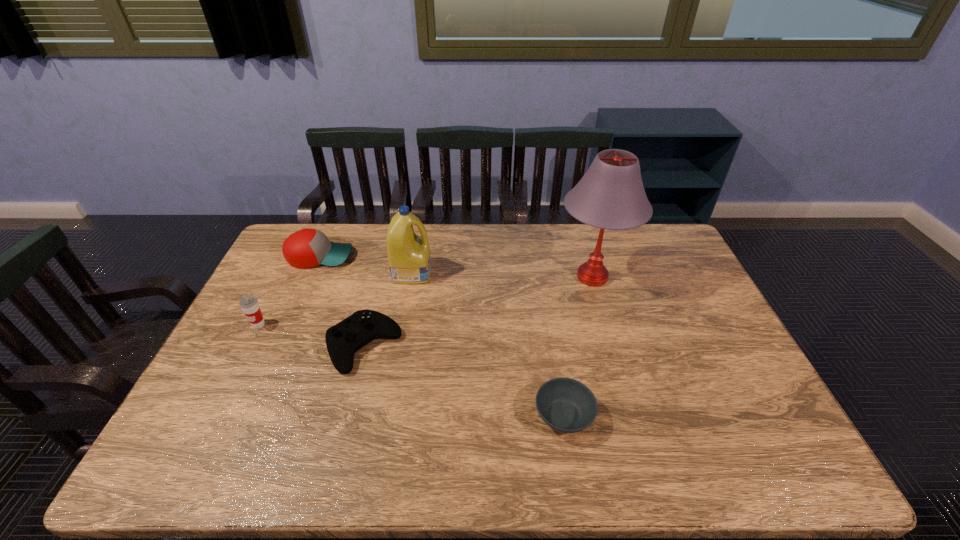
Identify the location of empty location between the second shortest object and the fourth shortest object. This screenshot has height=540, width=960. (311, 335).

Where is `vacant area that lies between the table lamp and the cup`? This screenshot has width=960, height=540. vacant area that lies between the table lamp and the cup is located at coordinates (425, 301).

Identify the location of vacant space that is in between the shortest object and the table lamp. This screenshot has height=540, width=960. (578, 346).

Identify the location of vacant area between the fifth tallest object and the table lamp. tap(478, 312).

Locate an element on the screen. Image resolution: width=960 pixels, height=540 pixels. empty space that is in between the third tallest object and the nearest object is located at coordinates (411, 370).

The image size is (960, 540). In order to click on blank region between the fourth tallest object and the shortest object in this screenshot , I will do `click(442, 336)`.

This screenshot has width=960, height=540. Find the location of `empty location between the table lamp and the detergent`. empty location between the table lamp and the detergent is located at coordinates (502, 274).

At what (x,y) coordinates should I click in order to perform the action: click on the second closest object to the fifth shortest object. Please return your answer as a coordinate pair (x, y). Image resolution: width=960 pixels, height=540 pixels. Looking at the image, I should click on (343, 340).

Locate which object is the second closest to the fourth tallest object. Please provide its 2D coordinates. Your answer should be formatted as a tuple, i.e. [(x, y)], where the tuple contains the x and y coordinates of a point satisfying the conditions above.

[(249, 304)]

At what (x,y) coordinates should I click in order to perform the action: click on free space in the image that satisfies the following two spatial constraints: 1. on the label of the second tallest object; 2. on the side of the cup with the logo. Please return your answer as a coordinate pair (x, y). The height and width of the screenshot is (540, 960). Looking at the image, I should click on (402, 325).